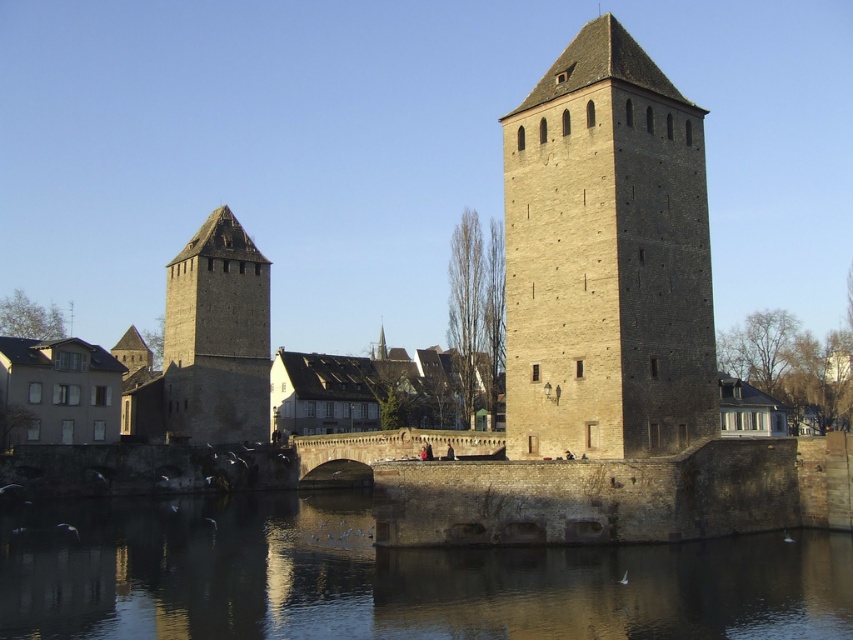
Question: Which of the following is the farthest from the observer?

Choices:
 (A) beige stone tower at center
 (B) smooth stone water at lower center
 (C) brown stone tower at left

Answer: (C)

Question: Based on their relative distances, which object is farther from the smooth stone water at lower center?

Choices:
 (A) brown stone tower at left
 (B) beige stone tower at center

Answer: (A)

Question: Can you confirm if beige stone tower at center is positioned below brown stone tower at left?

Choices:
 (A) no
 (B) yes

Answer: (A)

Question: Can you confirm if beige stone tower at center is thinner than brown stone tower at left?

Choices:
 (A) no
 (B) yes

Answer: (B)

Question: Does smooth stone water at lower center have a smaller size compared to brown stone tower at left?

Choices:
 (A) no
 (B) yes

Answer: (A)

Question: Which of these objects is positioned closest to the smooth stone water at lower center?

Choices:
 (A) beige stone tower at center
 (B) brown stone tower at left

Answer: (A)